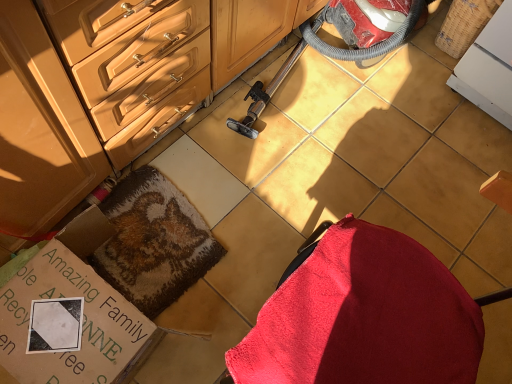
Question: Can you confirm if red plastic vacuum cleaner at center is shorter than cardboard box at lower left?

Choices:
 (A) no
 (B) yes

Answer: (A)

Question: From a real-world perspective, is red plastic vacuum cleaner at center physically above cardboard box at lower left?

Choices:
 (A) yes
 (B) no

Answer: (A)

Question: From the image's perspective, is red plastic vacuum cleaner at center located above cardboard box at lower left?

Choices:
 (A) yes
 (B) no

Answer: (A)

Question: Does red plastic vacuum cleaner at center appear on the right side of cardboard box at lower left?

Choices:
 (A) yes
 (B) no

Answer: (A)

Question: Is red plastic vacuum cleaner at center looking in the opposite direction of cardboard box at lower left?

Choices:
 (A) no
 (B) yes

Answer: (A)

Question: Is point (124, 261) closer or farther from the camera than point (76, 127)?

Choices:
 (A) farther
 (B) closer

Answer: (A)

Question: From the image's perspective, is fluffy brown rug at center positioned above or below matte wood cabinetry at center?

Choices:
 (A) above
 (B) below

Answer: (B)

Question: Which is correct: fluffy brown rug at center is inside matte wood cabinetry at center, or outside of it?

Choices:
 (A) inside
 (B) outside

Answer: (B)

Question: From a real-world perspective, relative to matte wood cabinetry at center, is fluffy brown rug at center vertically above or below?

Choices:
 (A) below
 (B) above

Answer: (A)

Question: In terms of width, does cardboard box at lower left look wider or thinner when compared to matte wood cabinetry at center?

Choices:
 (A) thin
 (B) wide

Answer: (A)

Question: From a real-world perspective, relative to matte wood cabinetry at center, is cardboard box at lower left vertically above or below?

Choices:
 (A) above
 (B) below

Answer: (B)

Question: From the image's perspective, is cardboard box at lower left above or below matte wood cabinetry at center?

Choices:
 (A) above
 (B) below

Answer: (B)

Question: Is cardboard box at lower left situated inside matte wood cabinetry at center or outside?

Choices:
 (A) outside
 (B) inside

Answer: (A)

Question: Is fluffy brown rug at center taller or shorter than red plastic vacuum cleaner at center?

Choices:
 (A) short
 (B) tall

Answer: (A)

Question: Is fluffy brown rug at center wider or thinner than red plastic vacuum cleaner at center?

Choices:
 (A) thin
 (B) wide

Answer: (A)